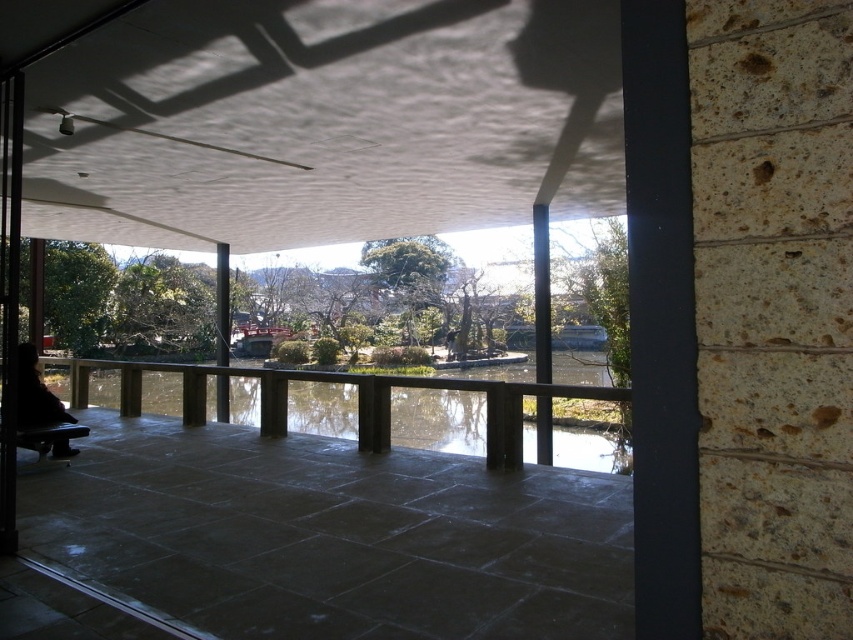
Question: Among these objects, which one is nearest to the camera?

Choices:
 (A) white textured ceiling at upper center
 (B) transparent glass water at center

Answer: (B)

Question: Is white textured ceiling at upper center positioned before transparent glass water at center?

Choices:
 (A) no
 (B) yes

Answer: (A)

Question: Which point is closer to the camera taking this photo?

Choices:
 (A) (437, 428)
 (B) (173, 148)

Answer: (B)

Question: Is white textured ceiling at upper center wider than transparent glass water at center?

Choices:
 (A) no
 (B) yes

Answer: (A)

Question: Which point appears closest to the camera in this image?

Choices:
 (A) (239, 100)
 (B) (436, 436)

Answer: (A)

Question: Does white textured ceiling at upper center have a greater width compared to transparent glass water at center?

Choices:
 (A) yes
 (B) no

Answer: (B)